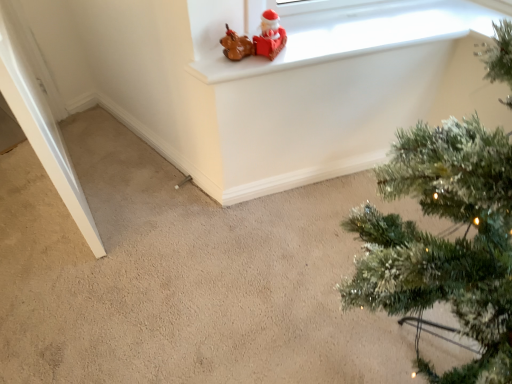
What do you see at coordinates (340, 30) in the screenshot? This screenshot has width=512, height=384. I see `matte white window frame at upper center` at bounding box center [340, 30].

Identify the location of matte brown figurine at upper center. The height and width of the screenshot is (384, 512). (256, 40).

Which of these two, matte brown figurine at upper center or green textured christmas tree at upper right, is bigger?

With larger size is green textured christmas tree at upper right.

Is matte brown figurine at upper center wider or thinner than green textured christmas tree at upper right?

matte brown figurine at upper center is thinner than green textured christmas tree at upper right.

The image size is (512, 384). I want to click on toy located on the left of green textured christmas tree at upper right, so click(x=256, y=40).

From a real-world perspective, who is located lower, matte brown figurine at upper center or green textured christmas tree at upper right?

From a 3D spatial view, green textured christmas tree at upper right is below.

Considering the sizes of green textured christmas tree at upper right and matte brown figurine at upper center in the image, is green textured christmas tree at upper right taller or shorter than matte brown figurine at upper center?

Clearly, green textured christmas tree at upper right is taller compared to matte brown figurine at upper center.

You are a GUI agent. You are given a task and a screenshot of the screen. Output one action in this format:
    pyautogui.click(x=<x>, y=<y>)
    Task: Click on the toy lying on the left of green textured christmas tree at upper right
    The image size is (512, 384).
    Given the screenshot: What is the action you would take?
    pyautogui.click(x=256, y=40)

Is matte brown figurine at upper center inside green textured christmas tree at upper right?

No, green textured christmas tree at upper right does not contain matte brown figurine at upper center.

Based on the photo, considering the relative sizes of green textured christmas tree at upper right and matte brown figurine at upper center in the image provided, is green textured christmas tree at upper right thinner than matte brown figurine at upper center?

No, green textured christmas tree at upper right is not thinner than matte brown figurine at upper center.

In the scene shown: From the image's perspective, which one is positioned higher, green textured christmas tree at upper right or matte white window frame at upper center?

matte white window frame at upper center.

Which object is wider, green textured christmas tree at upper right or matte white window frame at upper center?

Wider between the two is green textured christmas tree at upper right.

From the picture: Does green textured christmas tree at upper right lie in front of matte white window frame at upper center?

That is True.

From the image's perspective, which one is positioned higher, matte white window frame at upper center or green textured christmas tree at upper right?

matte white window frame at upper center is shown above in the image.

Can you confirm if matte white window frame at upper center is positioned to the right of green textured christmas tree at upper right?

Incorrect, matte white window frame at upper center is not on the right side of green textured christmas tree at upper right.

Is matte white window frame at upper center facing towards green textured christmas tree at upper right?

Yes, matte white window frame at upper center is aimed at green textured christmas tree at upper right.

Which is closer to the camera, (294, 18) or (280, 50)?

Point (294, 18) appears to be farther away from the viewer than point (280, 50).

Considering the sizes of matte white window frame at upper center and matte brown figurine at upper center in the image, is matte white window frame at upper center taller or shorter than matte brown figurine at upper center?

matte white window frame at upper center is shorter than matte brown figurine at upper center.

From the image's perspective, between matte white window frame at upper center and matte brown figurine at upper center, which one is located above?

matte white window frame at upper center, from the image's perspective.

Which object is closer to the camera taking this photo, matte white window frame at upper center or matte brown figurine at upper center?

matte brown figurine at upper center is closer to the camera.

Is matte brown figurine at upper center turned away from matte white window frame at upper center?

That's not correct — matte brown figurine at upper center is not looking away from matte white window frame at upper center.

Is matte white window frame at upper center a part of matte brown figurine at upper center?

No, matte white window frame at upper center is not a part of matte brown figurine at upper center.

Is point (225, 53) in front of point (280, 16)?

Yes, it is.

The width and height of the screenshot is (512, 384). Identify the location of window frame that appears below the matte brown figurine at upper center (from a real-world perspective). (340, 30).

Where is `toy on the left of green textured christmas tree at upper right`? toy on the left of green textured christmas tree at upper right is located at coordinates (256, 40).

This screenshot has height=384, width=512. Identify the location of christmas tree that appears in front of the matte brown figurine at upper center. (444, 241).

When comparing their distances from matte brown figurine at upper center, does green textured christmas tree at upper right or matte white window frame at upper center seem closer?

matte white window frame at upper center.

When comparing their distances from matte white window frame at upper center, does green textured christmas tree at upper right or matte brown figurine at upper center seem closer?

Based on the image, matte brown figurine at upper center appears to be nearer to matte white window frame at upper center.

Which object lies further to the anchor point green textured christmas tree at upper right, matte brown figurine at upper center or matte white window frame at upper center?

Among the two, matte brown figurine at upper center is located further to green textured christmas tree at upper right.

Looking at the image, which one is located further to matte brown figurine at upper center, matte white window frame at upper center or green textured christmas tree at upper right?

green textured christmas tree at upper right.

Which object lies further to the anchor point green textured christmas tree at upper right, matte white window frame at upper center or matte brown figurine at upper center?

matte brown figurine at upper center lies further to green textured christmas tree at upper right than the other object.

Looking at the image, which one is located closer to matte white window frame at upper center, matte brown figurine at upper center or green textured christmas tree at upper right?

matte brown figurine at upper center.

Where is `toy located between green textured christmas tree at upper right and matte white window frame at upper center in the depth direction`? The height and width of the screenshot is (384, 512). toy located between green textured christmas tree at upper right and matte white window frame at upper center in the depth direction is located at coordinates (256, 40).